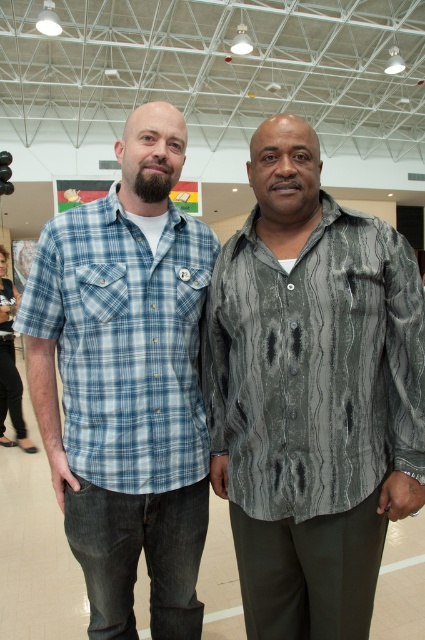
Question: Is textured gray shirt at center bigger than blue plaid shirt at center?

Choices:
 (A) yes
 (B) no

Answer: (B)

Question: Which point appears closest to the camera in this image?

Choices:
 (A) (78, 269)
 (B) (396, 476)

Answer: (B)

Question: Does textured gray shirt at center appear over blue plaid shirt at center?

Choices:
 (A) yes
 (B) no

Answer: (A)

Question: Is textured gray shirt at center positioned in front of blue plaid shirt at center?

Choices:
 (A) yes
 (B) no

Answer: (A)